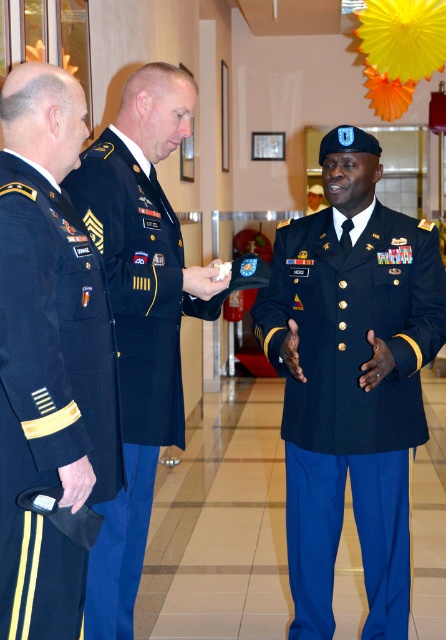
Does navy blue uniform at center come behind navy blue fabric uniform at center?

Yes, navy blue uniform at center is further from the viewer.

Does navy blue uniform at center have a smaller size compared to navy blue fabric uniform at center?

Correct, navy blue uniform at center occupies less space than navy blue fabric uniform at center.

Between point (335, 356) and point (156, 234), which one is positioned in front?

Positioned in front is point (335, 356).

This screenshot has height=640, width=446. I want to click on navy blue uniform at center, so click(x=351, y=401).

Is navy blue uniform at center to the left of navy blue fabric uniform at left from the viewer's perspective?

In fact, navy blue uniform at center is to the right of navy blue fabric uniform at left.

Find the location of `navy blue uniform at center`. navy blue uniform at center is located at coordinates (351, 401).

The image size is (446, 640). I want to click on navy blue uniform at center, so click(351, 401).

Which is below, navy blue fabric uniform at left or navy blue fabric uniform at center?

navy blue fabric uniform at center is below.

Locate an element on the screen. The height and width of the screenshot is (640, 446). navy blue fabric uniform at left is located at coordinates (49, 396).

Where is `navy blue fabric uniform at left`? This screenshot has width=446, height=640. navy blue fabric uniform at left is located at coordinates (49, 396).